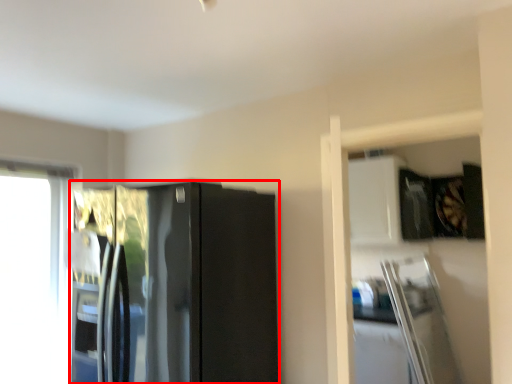
Question: From the image's perspective, considering the relative positions of refrigerator (annotated by the red box) and window in the image provided, where is refrigerator (annotated by the red box) located with respect to the staircase?

Choices:
 (A) below
 (B) above

Answer: (B)